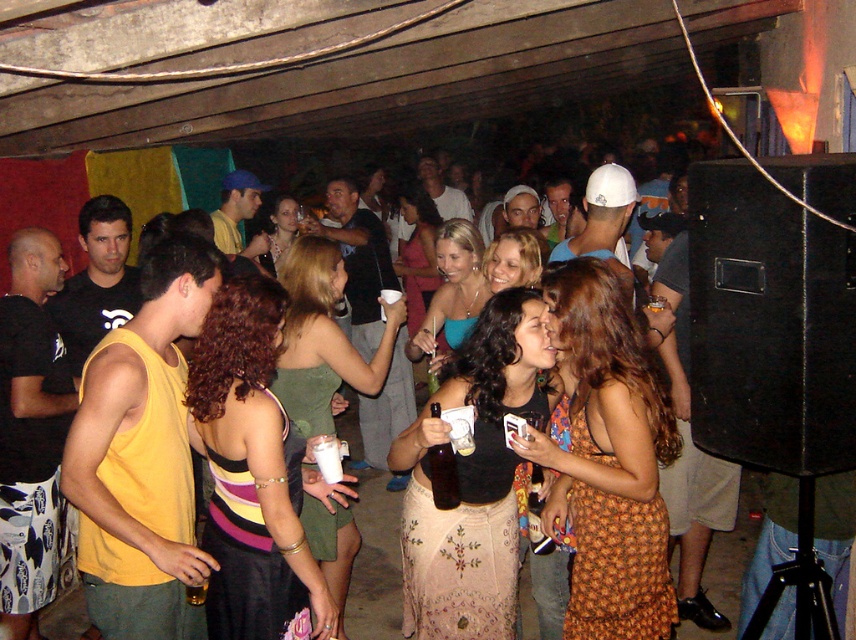
Is point (560, 474) farther from camera compared to point (429, 362)?

No, (560, 474) is in front of (429, 362).

Does orange printed dress at center appear over matte blue tank top at center?

No.

Which is behind, point (645, 385) or point (456, 326)?

The point (456, 326) is behind.

Image resolution: width=856 pixels, height=640 pixels. What are the coordinates of `orange printed dress at center` in the screenshot? It's located at (607, 460).

Is the position of green satin dress at center less distant than that of matte green dress at center?

Yes, green satin dress at center is in front of matte green dress at center.

What do you see at coordinates (322, 339) in the screenshot?
I see `green satin dress at center` at bounding box center [322, 339].

In order to click on green satin dress at center in this screenshot , I will do `click(322, 339)`.

Measure the distance between point (485, 512) and camera.

A distance of 8.75 feet exists between point (485, 512) and camera.

Between point (516, 531) and point (281, 195), which one is positioned behind?

Positioned behind is point (281, 195).

The height and width of the screenshot is (640, 856). I want to click on matte black tank top at center, so click(473, 480).